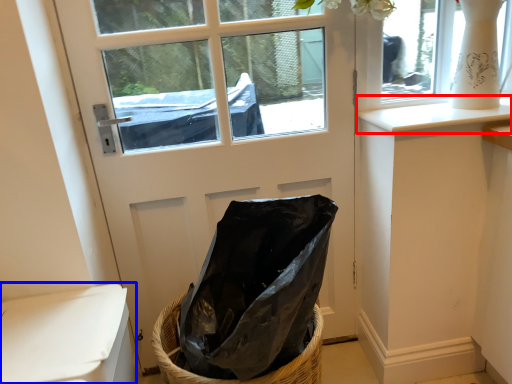
Question: Which of the following is the closest to the observer, window sill (highlighted by a red box) or armchair (highlighted by a blue box)?

Choices:
 (A) window sill
 (B) armchair

Answer: (B)